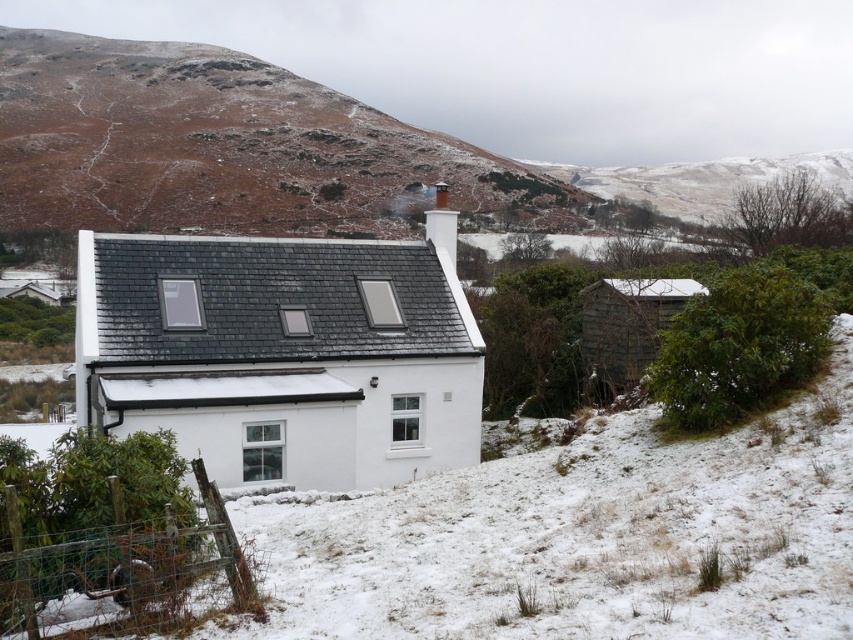
You are planning to install a new satellite dish on the white slate roof at center. The satellite dish requires a minimum of 1.5 meters of space horizontally from the edge of the brown textured rock at upper left to avoid interference. Given the spatial relationship between the two objects, will the satellite dish installation be feasible?

The white slate roof at center is narrower than the brown textured rock at upper left. Since the roof is narrower, there might not be enough horizontal space between the edge of the rock and the roof to accommodate the satellite dish requiring 1.5 meters. Therefore, the installation may not be feasible.

From the picture: You are standing in the snowy garden in front of the white house. You want to take a photo of the house with your camera, which has a zoom lens that can focus on objects at a specific coordinate point. The camera is currently pointing towards the center of the image. Should you adjust the focus to point towards the white slate roof at center to capture it clearly?

The white slate roof at center is located at point (283,353), so yes, you should adjust the focus to that coordinate to capture it clearly since it is not at the exact center of the image.

You are standing in front of the house and want to walk to the wooden shed at right. Which direction should you move relative to the white slate roof at center?

You should move to the right of the white slate roof at center to reach the wooden shed at right since the wooden shed at right is located to the right of the white slate roof at center.